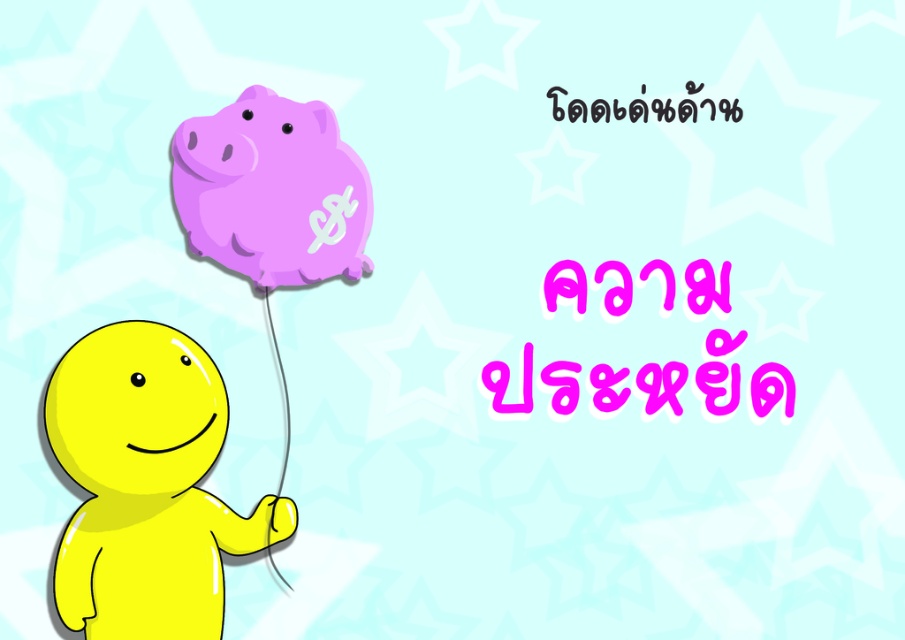
Who is more forward, (357, 156) or (702, 364)?

Positioned in front is point (357, 156).

Is point (280, 189) farther from camera compared to point (717, 340)?

No, (280, 189) is in front of (717, 340).

I want to click on matte purple piggy bank at upper center, so click(272, 189).

Is point (686, 278) positioned before point (572, 106)?

No.

The width and height of the screenshot is (905, 640). Identify the location of pink matte text at upper center. (719, 372).

Is point (713, 294) positioned after point (670, 104)?

Yes, point (713, 294) is behind point (670, 104).

Locate an element on the screen. The height and width of the screenshot is (640, 905). pink matte text at upper center is located at coordinates (719, 372).

Does matte purple piggy bank at upper center have a greater width compared to black text at upper center?

In fact, matte purple piggy bank at upper center might be narrower than black text at upper center.

Is matte purple piggy bank at upper center further to camera compared to black text at upper center?

No, matte purple piggy bank at upper center is closer to the viewer.

What do you see at coordinates (272, 189) in the screenshot? I see `matte purple piggy bank at upper center` at bounding box center [272, 189].

I want to click on matte purple piggy bank at upper center, so click(272, 189).